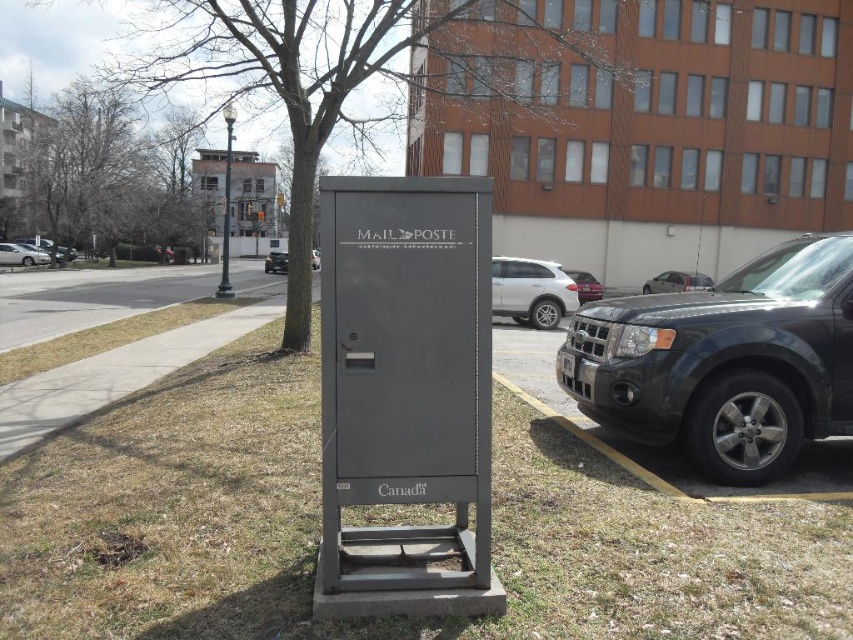
Is matte black suv at right smaller than bare branches at upper left?

Correct, matte black suv at right occupies less space than bare branches at upper left.

What do you see at coordinates (724, 362) in the screenshot? The width and height of the screenshot is (853, 640). I see `matte black suv at right` at bounding box center [724, 362].

Describe the element at coordinates (724, 362) in the screenshot. I see `matte black suv at right` at that location.

I want to click on matte black suv at right, so click(724, 362).

Does point (738, 576) come behind point (668, 284)?

That is False.

Is green grass at center wider than silver metallic sedan at right?

No, green grass at center is not wider than silver metallic sedan at right.

Between point (126, 403) and point (695, 282), which one is positioned in front?

Point (126, 403)

Locate an element on the screen. This screenshot has width=853, height=640. green grass at center is located at coordinates (318, 529).

Is point (659, 422) in front of point (560, 307)?

Yes, point (659, 422) is in front of point (560, 307).

Where is `matte black suv at right`? matte black suv at right is located at coordinates (724, 362).

Describe the element at coordinates (724, 362) in the screenshot. I see `matte black suv at right` at that location.

The image size is (853, 640). Identify the location of matte black suv at right. point(724,362).